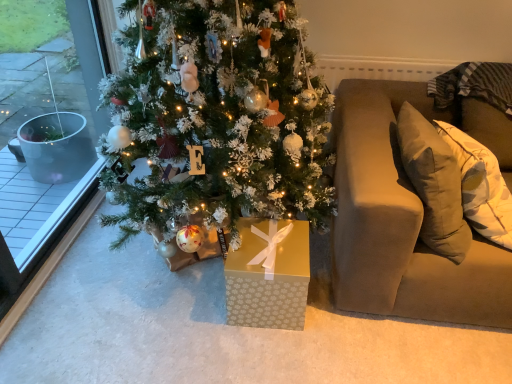
Identify the location of white frosted christmas tree at center. (220, 117).

Measure the distance between point (8, 210) and camera.

The distance of point (8, 210) from camera is 2.39 meters.

The height and width of the screenshot is (384, 512). Describe the element at coordinates (52, 78) in the screenshot. I see `clear glass window at left` at that location.

The height and width of the screenshot is (384, 512). What are the coordinates of `white frosted christmas tree at center` in the screenshot? It's located at (220, 117).

Is white frosted christmas tree at center far from clear glass window at left?

Yes, white frosted christmas tree at center and clear glass window at left are located far from each other.

Where is `christmas tree above the clear glass window at left (from a real-world perspective)`? The width and height of the screenshot is (512, 384). christmas tree above the clear glass window at left (from a real-world perspective) is located at coordinates (220, 117).

From a real-world perspective, which is physically below, white frosted christmas tree at center or clear glass window at left?

clear glass window at left is physically lower.

Does white frosted christmas tree at center appear on the right side of clear glass window at left?

Correct, you'll find white frosted christmas tree at center to the right of clear glass window at left.

From the picture: Are gold paper gift box at center and clear glass window at left located far from each other?

Indeed, gold paper gift box at center is not near clear glass window at left.

Measure the distance from gold paper gift box at center to clear glass window at left.

gold paper gift box at center and clear glass window at left are 5.30 feet apart from each other.

From a real-world perspective, which is physically above, gold paper gift box at center or clear glass window at left?

clear glass window at left.

Identify the location of window on the left side of gold paper gift box at center. (52, 78).

Between point (3, 209) and point (273, 305), which one is positioned in front?

Positioned in front is point (273, 305).

Based on the photo, who is taller, clear glass window at left or gold paper gift box at center?

clear glass window at left is taller.

Identify the location of window on the left of gold paper gift box at center. The image size is (512, 384). click(52, 78).

In the scene shown: Can you confirm if clear glass window at left is thinner than gold paper gift box at center?

Correct, the width of clear glass window at left is less than that of gold paper gift box at center.

Consider the image. Considering the relative sizes of white frosted christmas tree at center and beige fabric couch at right in the image provided, is white frosted christmas tree at center thinner than beige fabric couch at right?

No.

Is white frosted christmas tree at center at the right side of beige fabric couch at right?

Incorrect, white frosted christmas tree at center is not on the right side of beige fabric couch at right.

Considering the relative sizes of white frosted christmas tree at center and beige fabric couch at right in the image provided, is white frosted christmas tree at center bigger than beige fabric couch at right?

Yes.

From the image's perspective, is white frosted christmas tree at center on beige fabric couch at right?

Yes, from the image's perspective, white frosted christmas tree at center is over beige fabric couch at right.

From the image's perspective, would you say beige fabric couch at right is shown under gold paper gift box at center?

No, from the image's perspective, beige fabric couch at right is not beneath gold paper gift box at center.

At what (x,y) coordinates should I click in order to perform the action: click on gift box lying behind the beige fabric couch at right. Please return your answer as a coordinate pair (x, y). This screenshot has width=512, height=384. Looking at the image, I should click on (269, 275).

Is beige fabric couch at right not inside gold paper gift box at center?

That's correct, beige fabric couch at right is outside of gold paper gift box at center.

Is beige fabric couch at right in front of or behind gold paper gift box at center in the image?

beige fabric couch at right is in front of gold paper gift box at center.

Is clear glass window at left bigger or smaller than white frosted christmas tree at center?

Considering their sizes, clear glass window at left takes up less space than white frosted christmas tree at center.

Is white frosted christmas tree at center surrounded by clear glass window at left?

Actually, white frosted christmas tree at center is outside clear glass window at left.

Is clear glass window at left far away from white frosted christmas tree at center?

Yes, clear glass window at left and white frosted christmas tree at center are located far from each other.

From the image's perspective, between clear glass window at left and white frosted christmas tree at center, who is located below?

white frosted christmas tree at center, from the image's perspective.

Considering the sizes of objects clear glass window at left and beige fabric couch at right in the image provided, who is shorter, clear glass window at left or beige fabric couch at right?

beige fabric couch at right.

Is clear glass window at left completely or partially outside of beige fabric couch at right?

Yes, clear glass window at left is outside of beige fabric couch at right.

Where is `studio couch on the right of clear glass window at left`? studio couch on the right of clear glass window at left is located at coordinates (408, 214).

Is clear glass window at left turned away from beige fabric couch at right?

No.

The width and height of the screenshot is (512, 384). Find the location of `christmas tree that is on the right side of clear glass window at left`. christmas tree that is on the right side of clear glass window at left is located at coordinates click(220, 117).

Locate an element on the screen. window that appears above the gold paper gift box at center (from the image's perspective) is located at coordinates (52, 78).

When comparing their distances from beige fabric couch at right, does white frosted christmas tree at center or clear glass window at left seem further?

clear glass window at left is positioned further to the anchor beige fabric couch at right.

Looking at the image, which one is located further to gold paper gift box at center, beige fabric couch at right or white frosted christmas tree at center?

white frosted christmas tree at center lies further to gold paper gift box at center than the other object.

Based on their spatial positions, is beige fabric couch at right or clear glass window at left further from gold paper gift box at center?

Based on the image, clear glass window at left appears to be further to gold paper gift box at center.

When comparing their distances from white frosted christmas tree at center, does gold paper gift box at center or beige fabric couch at right seem further?

The object further to white frosted christmas tree at center is beige fabric couch at right.

Based on their spatial positions, is gold paper gift box at center or beige fabric couch at right closer to clear glass window at left?

gold paper gift box at center lies closer to clear glass window at left than the other object.

Estimate the real-world distances between objects in this image. Which object is closer to beige fabric couch at right, clear glass window at left or gold paper gift box at center?

gold paper gift box at center is closer to beige fabric couch at right.

Looking at the image, which one is located further to beige fabric couch at right, white frosted christmas tree at center or gold paper gift box at center?

Among the two, white frosted christmas tree at center is located further to beige fabric couch at right.

Looking at the image, which one is located further to beige fabric couch at right, gold paper gift box at center or clear glass window at left?

clear glass window at left lies further to beige fabric couch at right than the other object.

The height and width of the screenshot is (384, 512). What are the coordinates of `christmas tree located between clear glass window at left and beige fabric couch at right in the left-right direction` in the screenshot? It's located at (220, 117).

This screenshot has height=384, width=512. Find the location of `christmas tree between clear glass window at left and gold paper gift box at center`. christmas tree between clear glass window at left and gold paper gift box at center is located at coordinates (220, 117).

Identify the location of gift box located between clear glass window at left and beige fabric couch at right in the left-right direction. (269, 275).

The image size is (512, 384). I want to click on gift box situated between white frosted christmas tree at center and beige fabric couch at right from left to right, so 269,275.